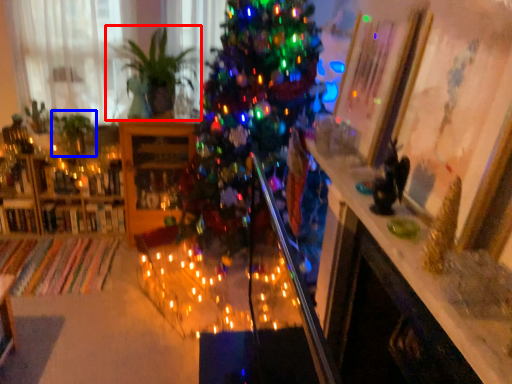
Question: Which of the following is the closest to the observer, houseplant (highlighted by a red box) or plant (highlighted by a blue box)?

Choices:
 (A) houseplant
 (B) plant

Answer: (A)